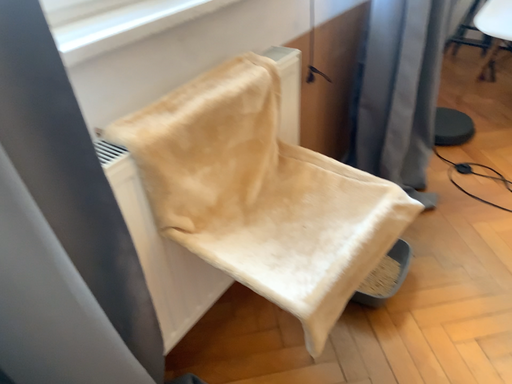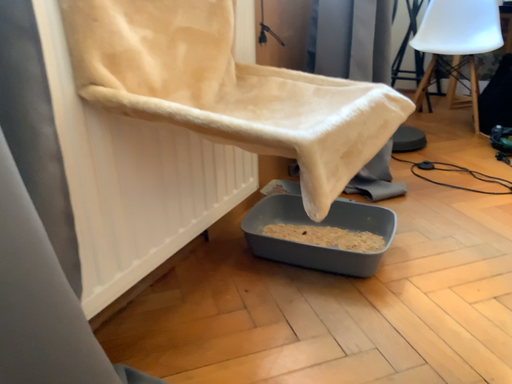
Question: How did the camera likely rotate when shooting the video?

Choices:
 (A) rotated left
 (B) rotated right

Answer: (B)